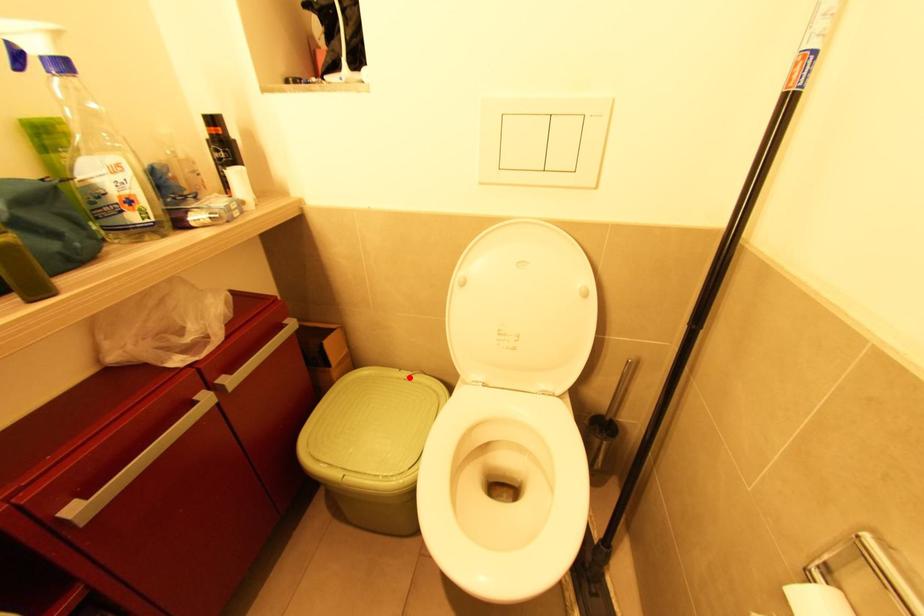
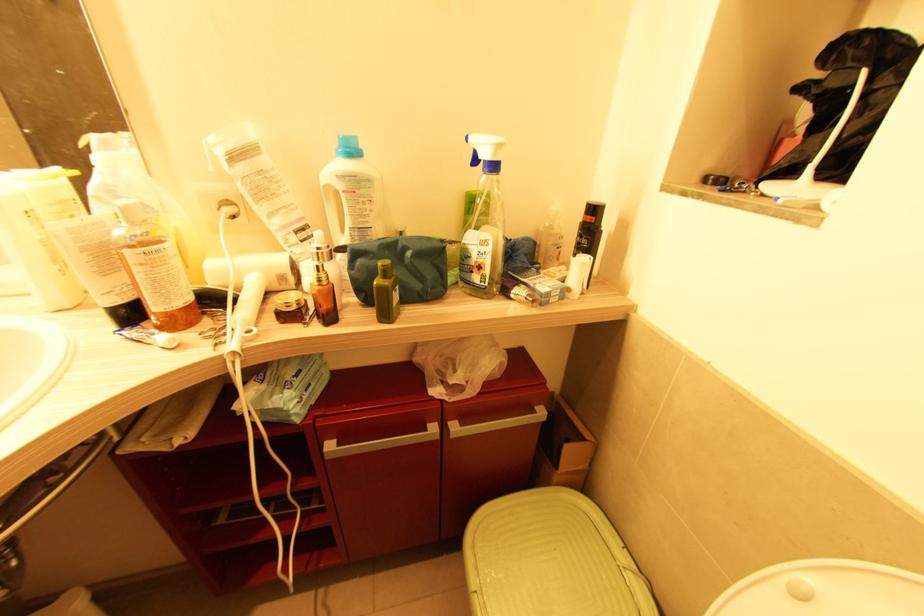
In the second image, find the point that corresponds to the highlighted location in the first image.

(626, 570)